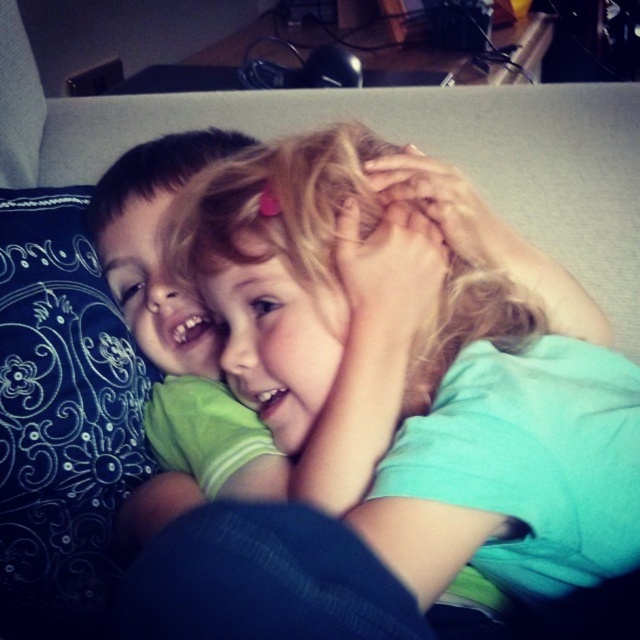
Who is more distant from viewer, (6,202) or (177,168)?

The point (6,202) is behind.

Is blue embroidered pillow at left taller than matte green shirt at center?

Yes.

Is point (44, 285) farther from viewer compared to point (152, 262)?

No, it is in front of (152, 262).

What are the coordinates of `blue embroidered pillow at left` in the screenshot? It's located at (61, 419).

How distant is blue embroidered pillow at left from dark blue fabric at center?

blue embroidered pillow at left and dark blue fabric at center are 15.64 inches apart from each other.

Does blue embroidered pillow at left have a smaller size compared to dark blue fabric at center?

No.

Is point (122, 346) positioned in front of point (228, 614)?

No, it is not.

Where is `blue embroidered pillow at left`? blue embroidered pillow at left is located at coordinates (61, 419).

Is point (276, 637) farther from viewer compared to point (109, 282)?

No, it is not.

Locate an element on the screen. The height and width of the screenshot is (640, 640). dark blue fabric at center is located at coordinates (260, 580).